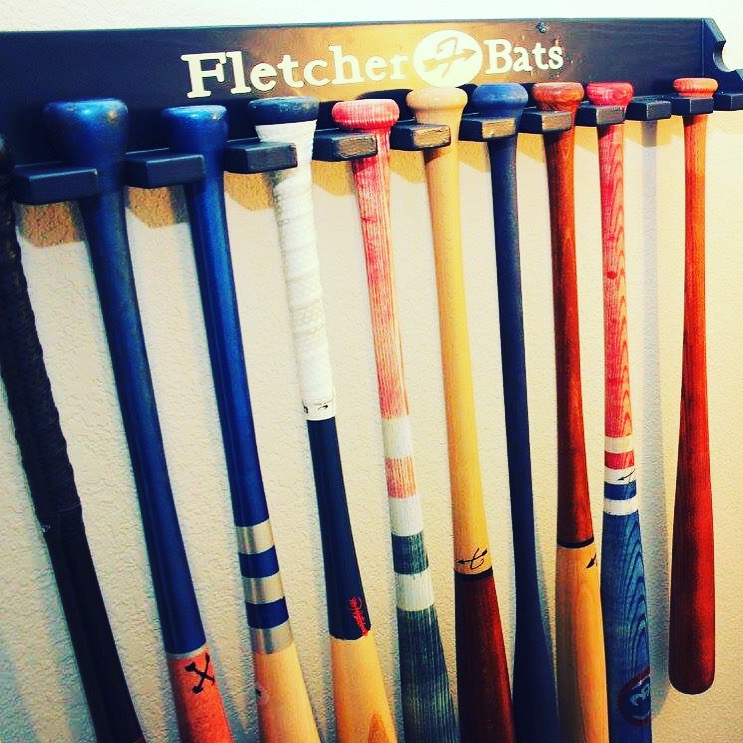
Locate an element on the screen. This screenshot has height=743, width=743. white wall is located at coordinates (270, 383).